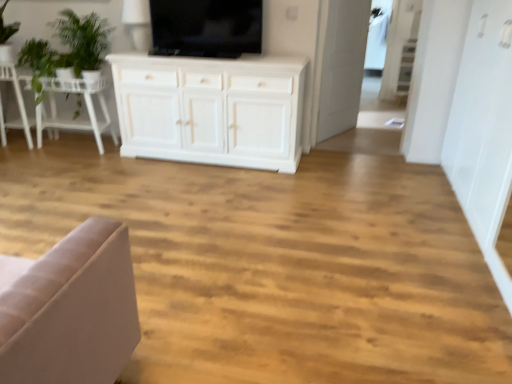
Question: From a real-world perspective, is black glossy tv at upper center above or below transparent glass door at upper right?

Choices:
 (A) above
 (B) below

Answer: (A)

Question: Is point (206, 0) positioned closer to the camera than point (372, 54)?

Choices:
 (A) farther
 (B) closer

Answer: (B)

Question: Which object is positioned farthest from the white wooden table at left?

Choices:
 (A) green fabric chair at left
 (B) green leafy plant at upper left
 (C) black glossy tv at upper center
 (D) transparent glass door at upper right

Answer: (D)

Question: Estimate the real-world distances between objects in this image. Which object is farther from the black glossy tv at upper center?

Choices:
 (A) green fabric chair at left
 (B) green leafy plant at upper left
 (C) white wooden table at left
 (D) transparent glass door at upper right

Answer: (D)